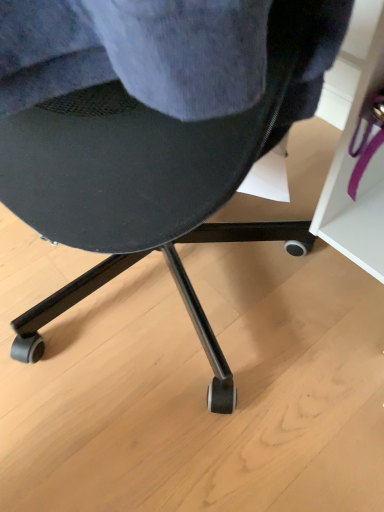
This screenshot has width=384, height=512. What do you see at coordinates (153, 174) in the screenshot?
I see `matte black chair at center` at bounding box center [153, 174].

Image resolution: width=384 pixels, height=512 pixels. Identify the location of matte black chair at center. (153, 174).

You are a GUI agent. You are given a task and a screenshot of the screen. Output one action in this format:
    pyautogui.click(x=<x>, y=<y>)
    Task: Click on the matte black chair at center
    This screenshot has height=512, width=384.
    Given the screenshot: What is the action you would take?
    pyautogui.click(x=153, y=174)